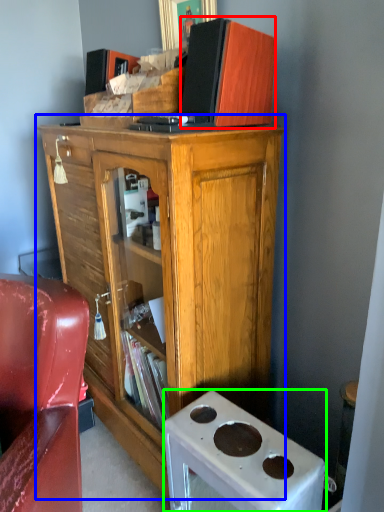
Question: Estimate the real-world distances between objects in this image. Which object is closer to book (highlighted by a red box), cabinetry (highlighted by a blue box) or desk (highlighted by a green box)?

Choices:
 (A) cabinetry
 (B) desk

Answer: (A)